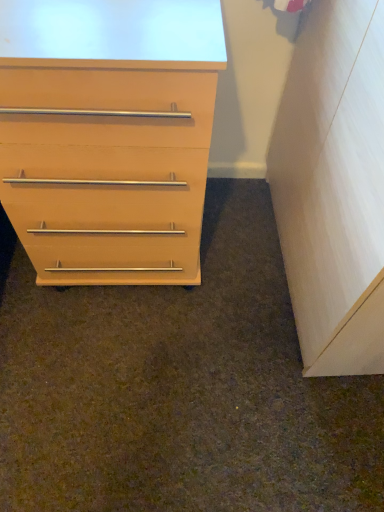
What is the approximate height of matte wood chest of drawers at left?

The height of matte wood chest of drawers at left is 31.71 inches.

The image size is (384, 512). What are the coordinates of `matte wood chest of drawers at left` in the screenshot? It's located at (108, 135).

What do you see at coordinates (108, 135) in the screenshot?
I see `matte wood chest of drawers at left` at bounding box center [108, 135].

I want to click on light wood/file cabinet at right, so click(x=334, y=187).

What do you see at coordinates (334, 187) in the screenshot?
I see `light wood/file cabinet at right` at bounding box center [334, 187].

In order to click on matte wood chest of drawers at left in this screenshot , I will do `click(108, 135)`.

Considering the relative positions of matte wood chest of drawers at left and light wood/file cabinet at right in the image provided, is matte wood chest of drawers at left to the right of light wood/file cabinet at right from the viewer's perspective?

No, matte wood chest of drawers at left is not to the right of light wood/file cabinet at right.

In the image, is matte wood chest of drawers at left positioned in front of or behind light wood/file cabinet at right?

matte wood chest of drawers at left is behind light wood/file cabinet at right.

Between point (147, 7) and point (325, 25), which one is positioned behind?

The point (325, 25) is more distant.

From the image's perspective, does matte wood chest of drawers at left appear lower than light wood/file cabinet at right?

Actually, matte wood chest of drawers at left appears above light wood/file cabinet at right in the image.

Looking at this image, from a real-world perspective, is matte wood chest of drawers at left positioned above or below light wood/file cabinet at right?

matte wood chest of drawers at left is situated lower than light wood/file cabinet at right in the real world.

Considering the sizes of matte wood chest of drawers at left and light wood/file cabinet at right in the image, is matte wood chest of drawers at left wider or thinner than light wood/file cabinet at right?

Considering their sizes, matte wood chest of drawers at left looks broader than light wood/file cabinet at right.

From the picture: Considering the sizes of objects matte wood chest of drawers at left and light wood/file cabinet at right in the image provided, who is taller, matte wood chest of drawers at left or light wood/file cabinet at right?

Standing taller between the two is light wood/file cabinet at right.

Considering the sizes of objects matte wood chest of drawers at left and light wood/file cabinet at right in the image provided, who is bigger, matte wood chest of drawers at left or light wood/file cabinet at right?

With larger size is matte wood chest of drawers at left.

Is light wood/file cabinet at right a part of matte wood chest of drawers at left?

No, light wood/file cabinet at right is located outside of matte wood chest of drawers at left.

Is there a large distance between matte wood chest of drawers at left and light wood/file cabinet at right?

No.

Is matte wood chest of drawers at left oriented towards light wood/file cabinet at right?

No, matte wood chest of drawers at left does not turn towards light wood/file cabinet at right.

How far apart are matte wood chest of drawers at left and light wood/file cabinet at right?

A distance of 17.11 inches exists between matte wood chest of drawers at left and light wood/file cabinet at right.

You are a GUI agent. You are given a task and a screenshot of the screen. Output one action in this format:
    pyautogui.click(x=<x>, y=<y>)
    Task: Click on the chest of drawers that appears above the light wood/file cabinet at right (from the image's perspective)
    
    Given the screenshot: What is the action you would take?
    pyautogui.click(x=108, y=135)

Does light wood/file cabinet at right appear on the left side of matte wood chest of drawers at left?

In fact, light wood/file cabinet at right is to the right of matte wood chest of drawers at left.

Does light wood/file cabinet at right come behind matte wood chest of drawers at left?

That is False.

Is point (375, 76) closer to camera compared to point (24, 220)?

Yes, it is in front of point (24, 220).

Consider the image. From the image's perspective, is light wood/file cabinet at right below matte wood chest of drawers at left?

Yes, from the image's perspective, light wood/file cabinet at right is beneath matte wood chest of drawers at left.

From a real-world perspective, is light wood/file cabinet at right physically located above or below matte wood chest of drawers at left?

From a real-world perspective, light wood/file cabinet at right is physically above matte wood chest of drawers at left.

Looking at their sizes, would you say light wood/file cabinet at right is wider or thinner than matte wood chest of drawers at left?

light wood/file cabinet at right is thinner than matte wood chest of drawers at left.

Is light wood/file cabinet at right taller than matte wood chest of drawers at left?

Indeed, light wood/file cabinet at right has a greater height compared to matte wood chest of drawers at left.

From the picture: Is light wood/file cabinet at right bigger than matte wood chest of drawers at left?

No, light wood/file cabinet at right is not bigger than matte wood chest of drawers at left.

Is light wood/file cabinet at right inside or outside of matte wood chest of drawers at left?

light wood/file cabinet at right lies outside matte wood chest of drawers at left.

Are light wood/file cabinet at right and matte wood chest of drawers at left beside each other?

No, light wood/file cabinet at right is not next to matte wood chest of drawers at left.

Is light wood/file cabinet at right facing towards matte wood chest of drawers at left?

Yes, light wood/file cabinet at right is oriented towards matte wood chest of drawers at left.

Where is `file cabinet in front of the matte wood chest of drawers at left`? The height and width of the screenshot is (512, 384). file cabinet in front of the matte wood chest of drawers at left is located at coordinates (334, 187).

Image resolution: width=384 pixels, height=512 pixels. In order to click on chest of drawers on the left of light wood/file cabinet at right in this screenshot , I will do `click(108, 135)`.

I want to click on file cabinet in front of the matte wood chest of drawers at left, so 334,187.